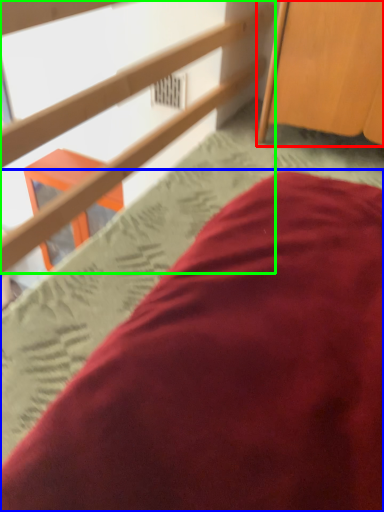
Question: Based on their relative distances, which object is nearer to furniture (highlighted by a red box)? Choose from bed (highlighted by a blue box) and rail (highlighted by a green box).

Choices:
 (A) bed
 (B) rail

Answer: (B)